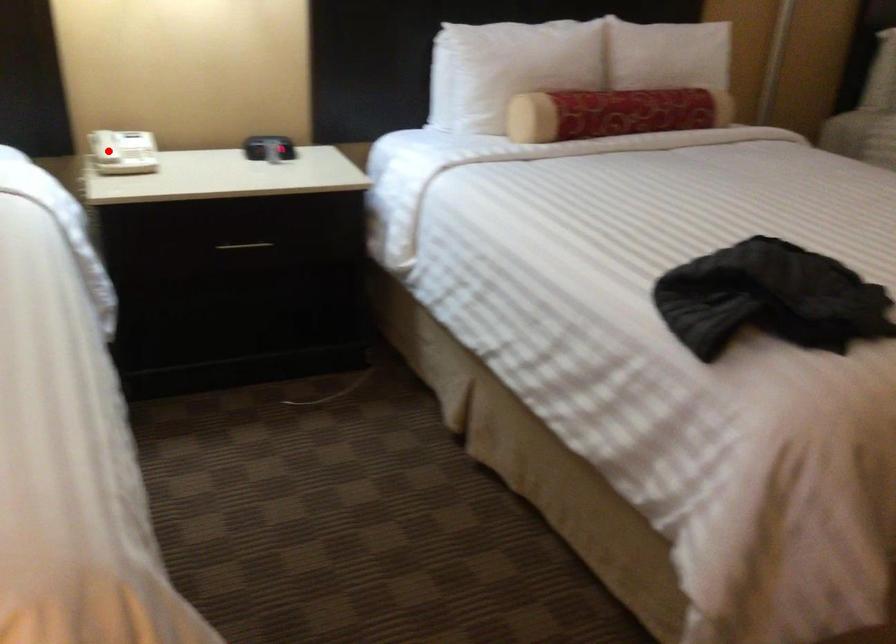
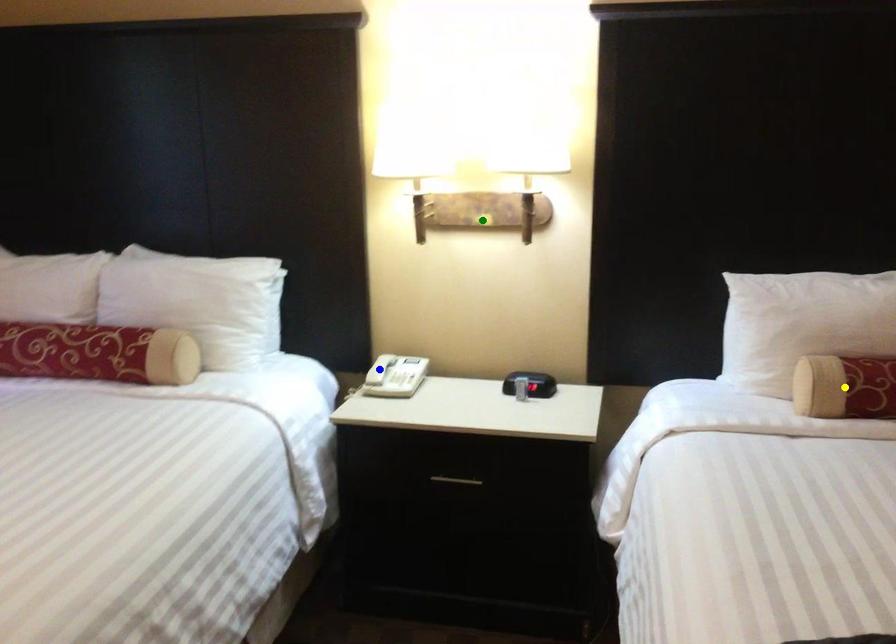
Question: I am providing you with two images of the same scene from different viewpoints. A red point is marked on the first image. You are given multiple points on the second image. In image 2, which mark is for the same physical point as the one in image 1?

Choices:
 (A) blue point
 (B) green point
 (C) yellow point

Answer: (A)